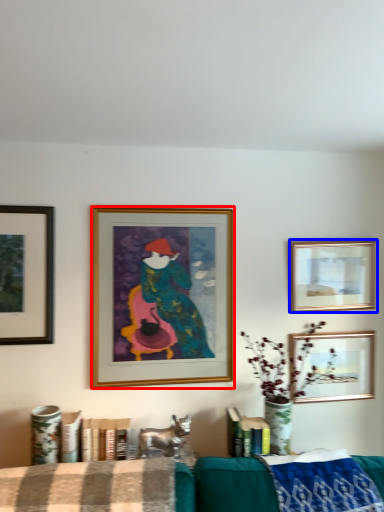
Question: Which object appears closest to the camera in this image, picture frame (highlighted by a red box) or picture frame (highlighted by a blue box)?

Choices:
 (A) picture frame
 (B) picture frame

Answer: (A)